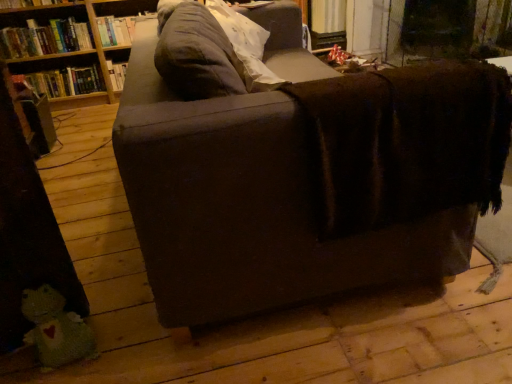
Locate an element on the screen. vacant space to the right of green knitted toy at lower left is located at coordinates (108, 358).